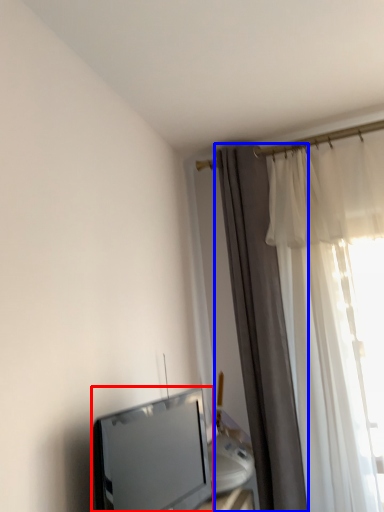
Question: Which of the following is the closest to the observer, television (highlighted by a red box) or curtain (highlighted by a blue box)?

Choices:
 (A) television
 (B) curtain

Answer: (A)